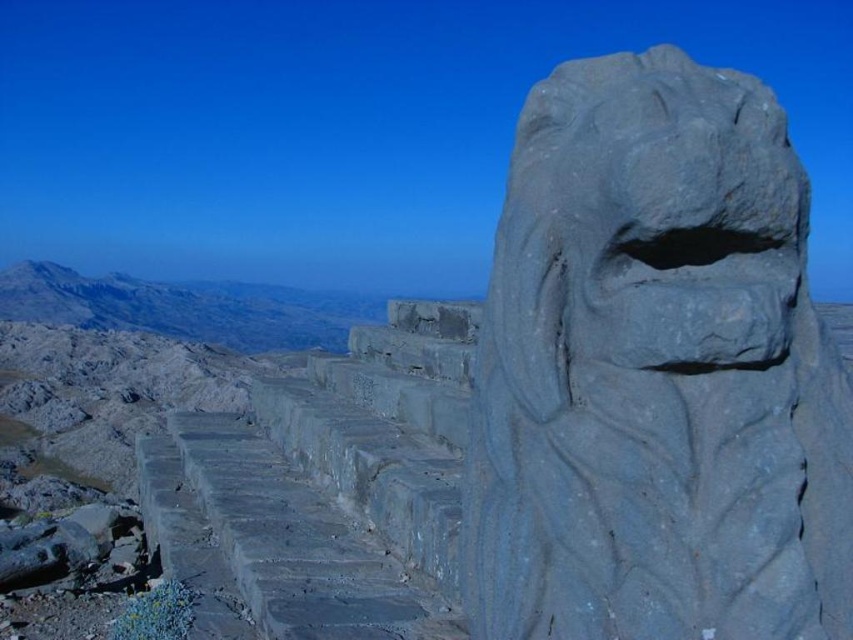
Does gray stone lion at right lie in front of rugged stone mountain at upper left?

Yes, it is.

Which is behind, point (693, 572) or point (16, 307)?

Positioned behind is point (16, 307).

The height and width of the screenshot is (640, 853). What are the coordinates of `gray stone lion at right` in the screenshot? It's located at (654, 372).